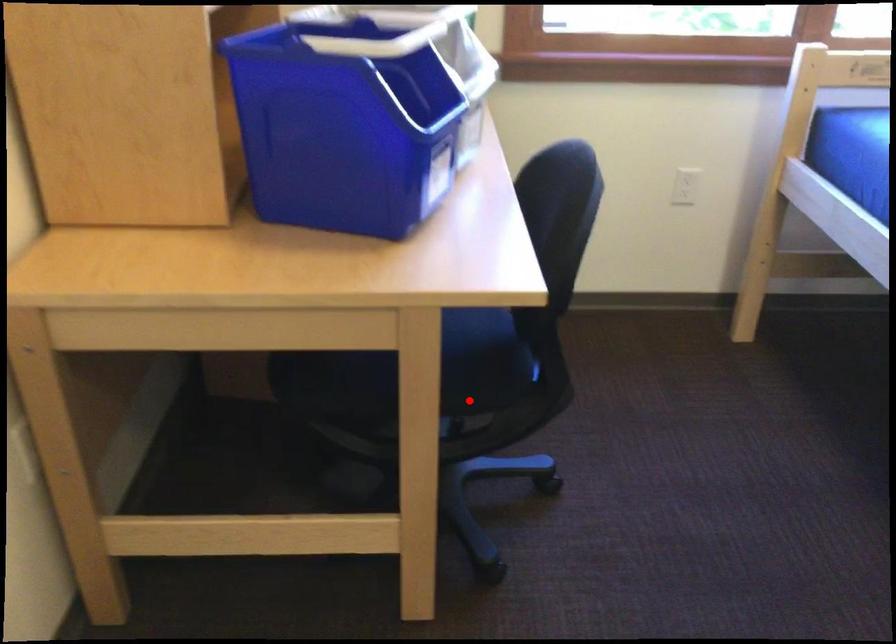
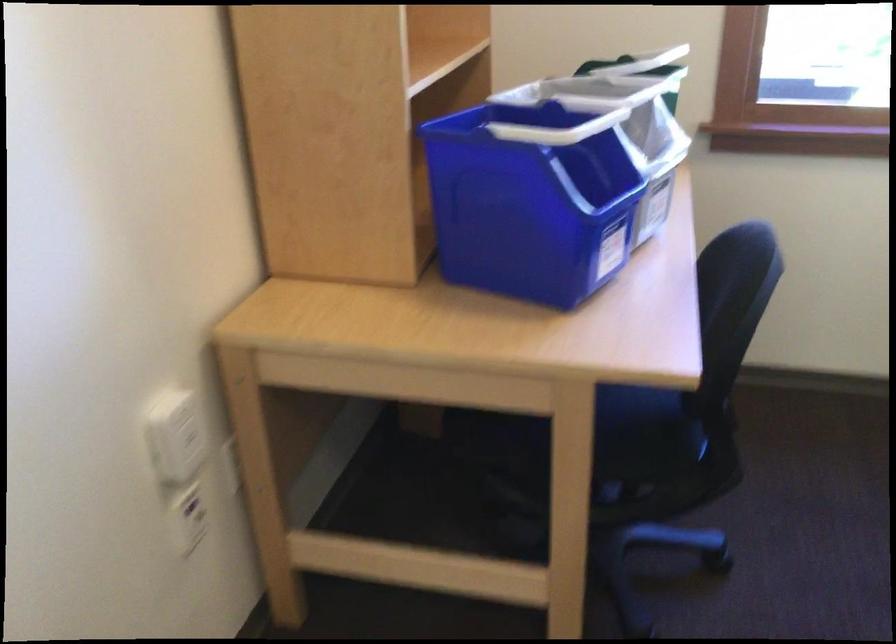
Where in the second image is the point corresponding to the highlighted location from the first image?

(625, 469)